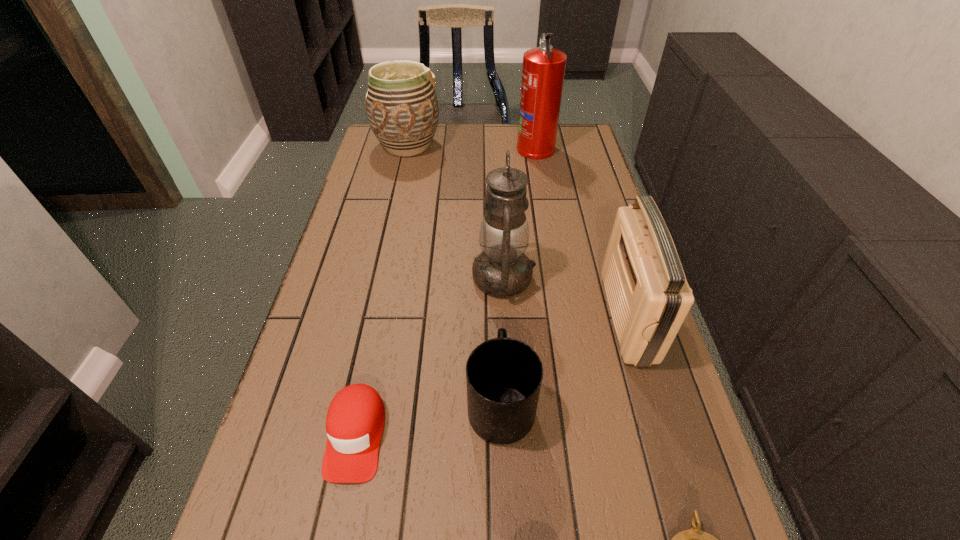
Select which object appears as the closest to the pottery. Please provide its 2D coordinates. Your answer should be formatted as a tuple, i.e. [(x, y)], where the tuple contains the x and y coordinates of a point satisfying the conditions above.

[(543, 70)]

This screenshot has height=540, width=960. In order to click on object identified as the closest to the oil lamp in this screenshot , I will do `click(504, 375)`.